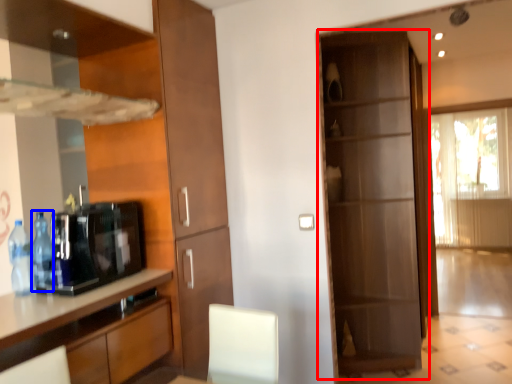
Question: Which point is closer to the camera, door (highlighted by a red box) or bottle (highlighted by a blue box)?

Choices:
 (A) door
 (B) bottle

Answer: (B)